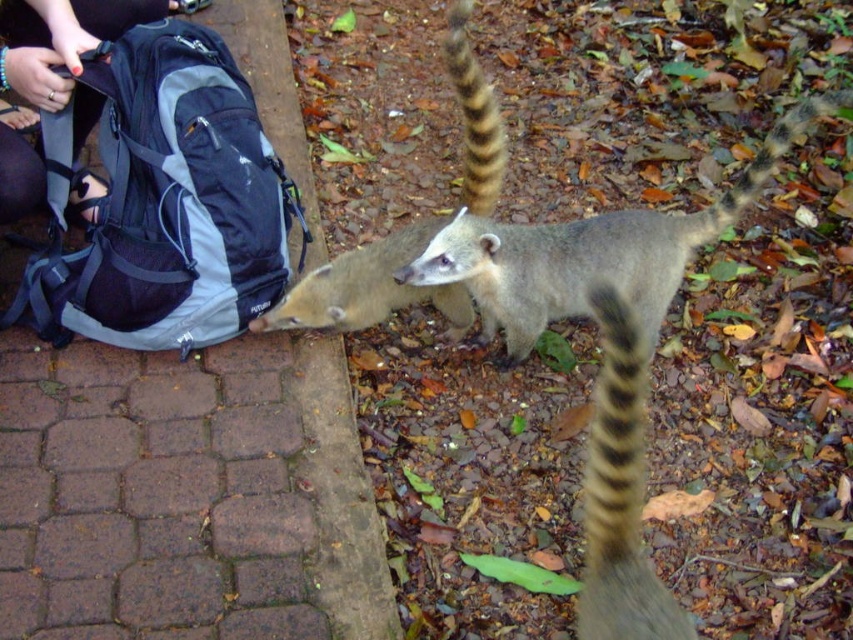
Who is taller, fuzzy gray lemur at center or brown fuzzy tail at upper right?

Standing taller between the two is brown fuzzy tail at upper right.

This screenshot has width=853, height=640. Identify the location of fuzzy gray lemur at center. (590, 250).

Based on the photo, between brown fuzzy tail at upper right and brown fur tail at center, which one has more height?

Standing taller between the two is brown fuzzy tail at upper right.

Does brown fuzzy tail at upper right appear over brown fur tail at center?

Indeed, brown fuzzy tail at upper right is positioned over brown fur tail at center.

What are the coordinates of `brown fuzzy tail at upper right` in the screenshot? It's located at (474, 116).

Is point (624, 506) farther from viewer compared to point (28, 36)?

No, it is in front of (28, 36).

Where is `brown/tan striped tail at right`? This screenshot has height=640, width=853. brown/tan striped tail at right is located at coordinates (619, 493).

Is point (602, 333) positioned behind point (28, 4)?

Yes, point (602, 333) is farther from viewer.

I want to click on brown/tan striped tail at right, so click(x=619, y=493).